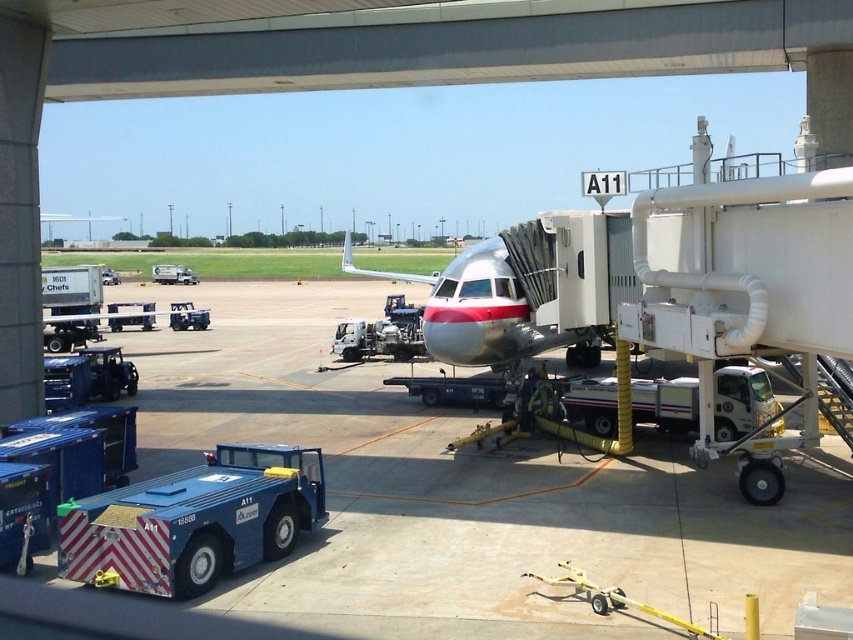
You are an airport ground crew member who needs to maneuver the blue metallic tug at lower left around the polished aluminum airplane at center. Given their widths, can the tug safely navigate around the airplane without any adjustments?

The blue metallic tug at lower left has a lesser width compared to the polished aluminum airplane at center, so it can safely navigate around the airplane without needing adjustments as its narrower width allows for easier maneuvering.

You are standing at the jet bridge entrance and want to move towards the baggage cart labeled A11. Which direction should you go relative to the blue metallic tug at lower left located at point (x=194, y=520)?

The blue metallic tug at lower left is located at point (x=194, y=520). To reach the baggage cart labeled A11, you should move towards the left relative to the blue metallic tug at lower left.